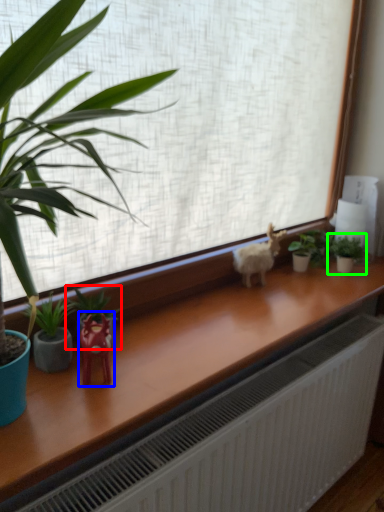
Question: Considering the real-world distances, which object is farthest from houseplant (highlighted by a red box)? miniature (highlighted by a blue box) or houseplant (highlighted by a green box)?

Choices:
 (A) miniature
 (B) houseplant

Answer: (B)